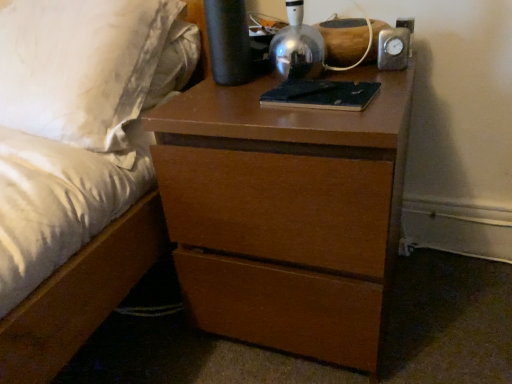
Identify the location of free space in front of dark blue leather book at center. Image resolution: width=512 pixels, height=384 pixels. (337, 119).